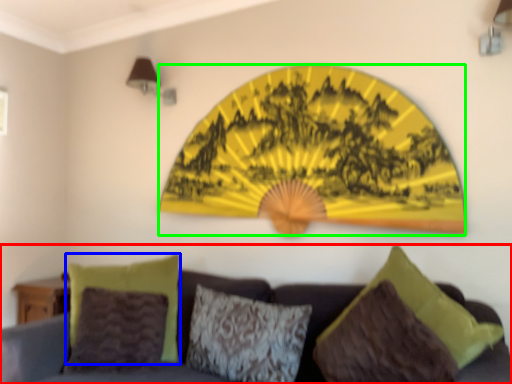
Question: Which is nearer to the studio couch (highlighted by a red box)? pillow (highlighted by a blue box) or design (highlighted by a green box).

Choices:
 (A) pillow
 (B) design

Answer: (A)